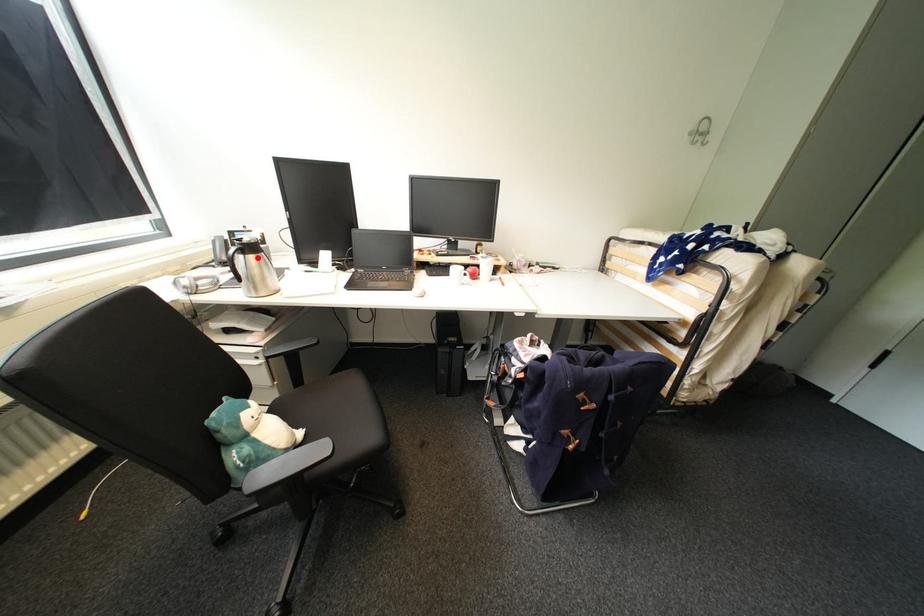
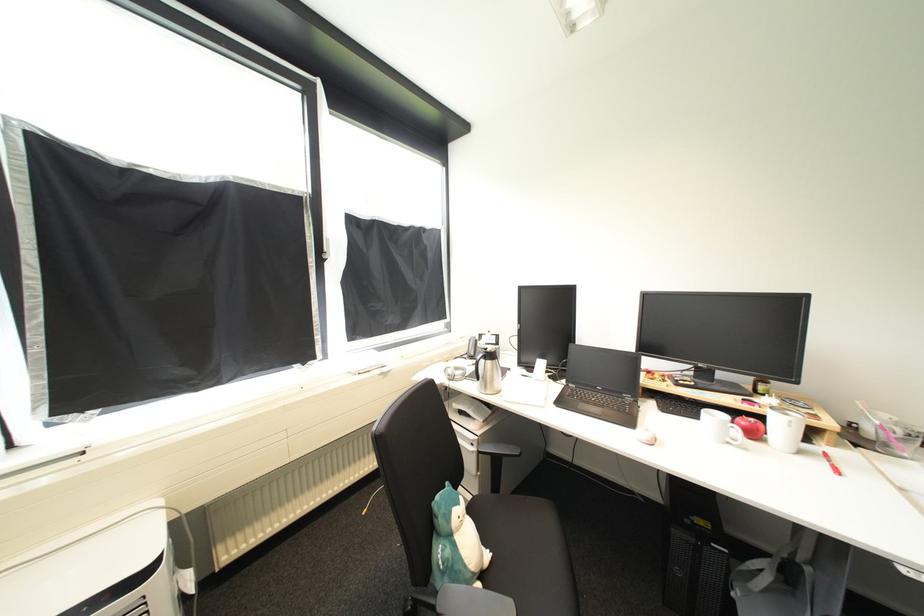
Question: I am providing you with two images of the same scene from different viewpoints. A red point is marked on the first image. At the location where the point appears in image 1, is it still visible in image 2?

Choices:
 (A) Yes
 (B) No

Answer: (A)